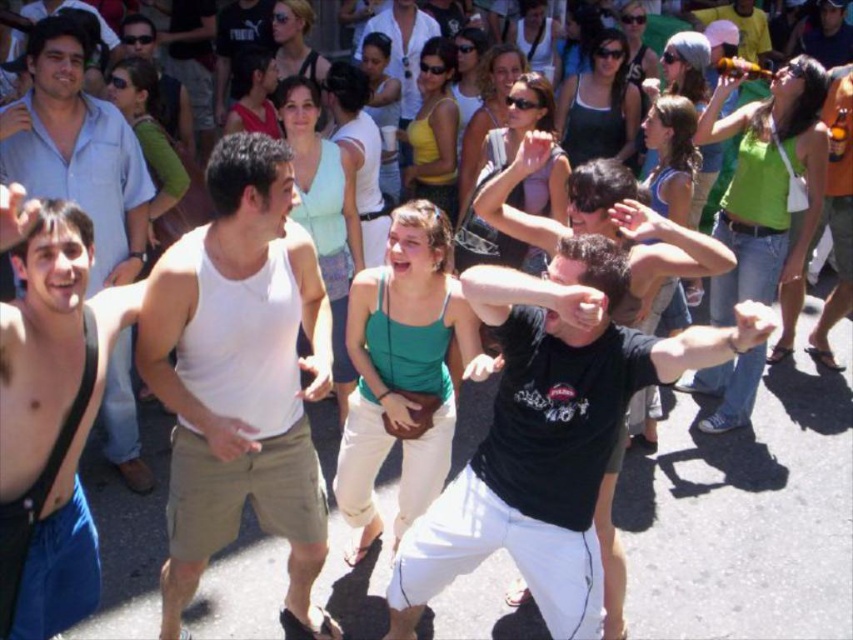
Question: Can you confirm if white cotton tank top at center is positioned to the left of black cotton t-shirt at center?

Choices:
 (A) no
 (B) yes

Answer: (B)

Question: Is white cotton tank top at center smaller than shiny blue shirt at left?

Choices:
 (A) yes
 (B) no

Answer: (B)

Question: Which of the following is the closest to the observer?

Choices:
 (A) (189, 500)
 (B) (482, 449)
 (C) (21, 636)

Answer: (C)

Question: Considering the real-world distances, which object is farthest from the white cotton tank top at center?

Choices:
 (A) black cotton t-shirt at center
 (B) shiny blue shirt at left

Answer: (B)

Question: Can you confirm if white cotton tank top at center is positioned to the right of black cotton t-shirt at center?

Choices:
 (A) yes
 (B) no

Answer: (B)

Question: Which object is the closest to the white cotton tank top at center?

Choices:
 (A) shiny blue shirt at left
 (B) black cotton t-shirt at center

Answer: (B)